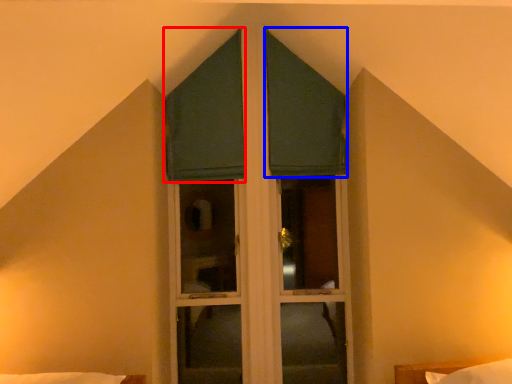
Question: Which of the following is the farthest to the observer, curtain (highlighted by a red box) or curtain (highlighted by a blue box)?

Choices:
 (A) curtain
 (B) curtain

Answer: (B)